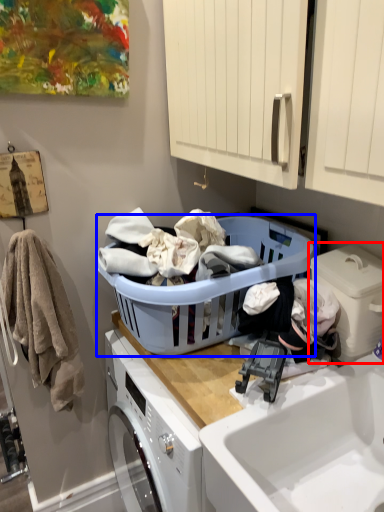
Question: Which object appears farthest to the camera in this image, washing machine (highlighted by a red box) or laundry basket (highlighted by a blue box)?

Choices:
 (A) washing machine
 (B) laundry basket

Answer: (A)